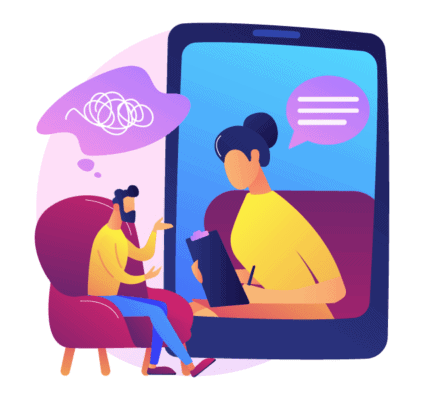
This screenshot has height=400, width=428. Identify the location of purple backrest of chair. [353, 226].